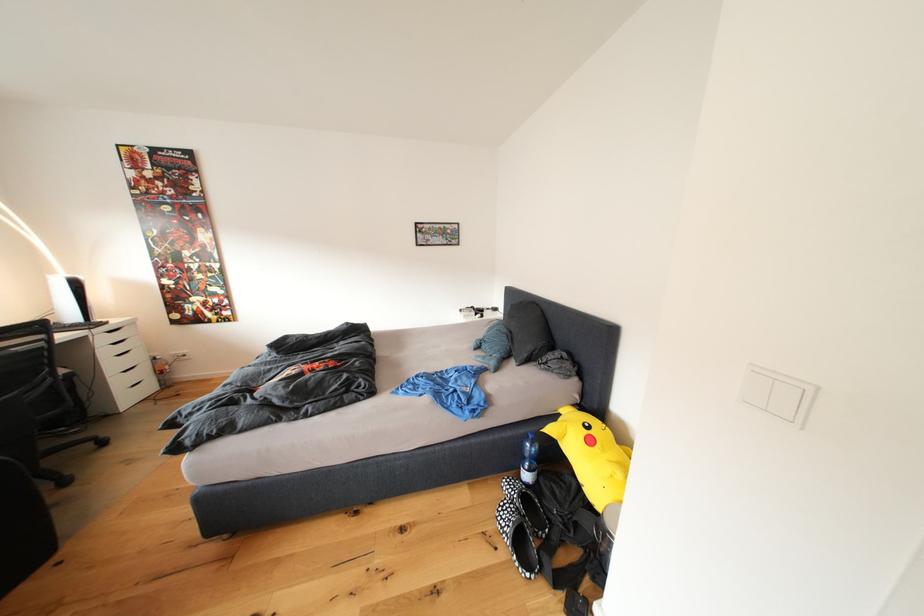
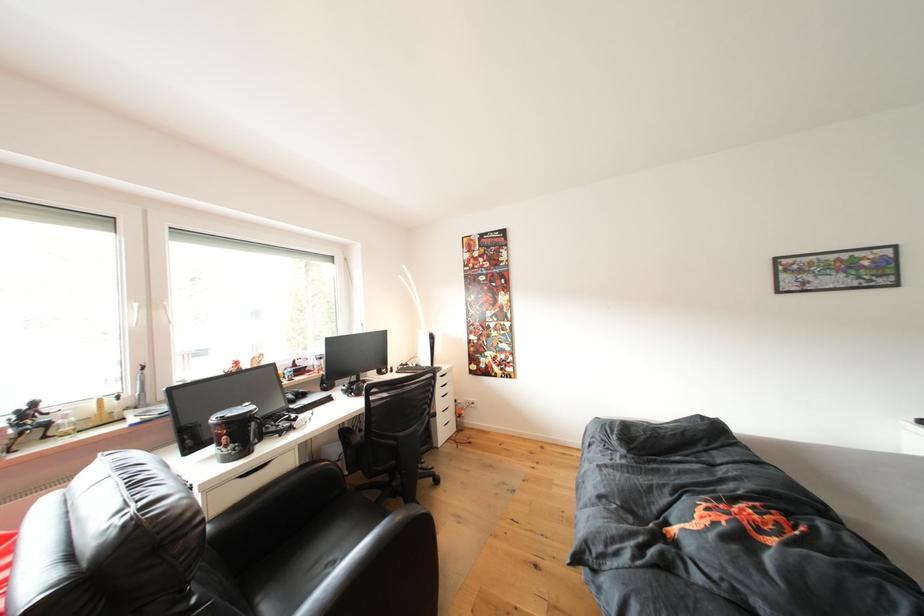
Locate, in the second image, the point that corresponds to [106,325] in the first image.

(444, 370)